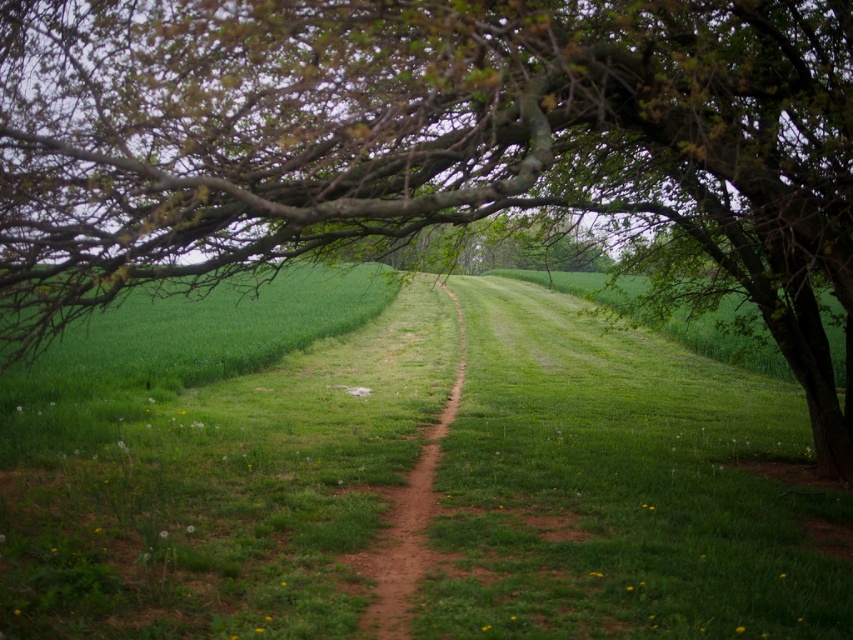
Based on the photo, which is above, green grassy at center or dirt path at center?

green grassy at center is higher up.

In the scene shown: Is green grassy at center positioned before dirt path at center?

Yes.

Locate an element on the screen. This screenshot has height=640, width=853. green grassy at center is located at coordinates (207, 477).